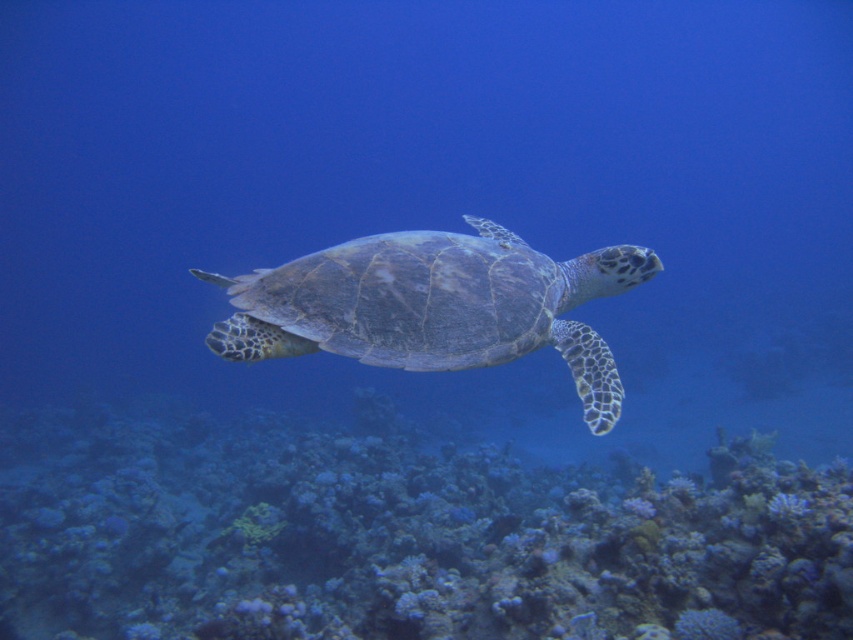
Who is shorter, rusty coral reef at center or greenish-gray textured shell at center?

greenish-gray textured shell at center

Is the position of rusty coral reef at center less distant than that of greenish-gray textured shell at center?

Yes, it is in front of greenish-gray textured shell at center.

Which is behind, point (44, 468) or point (605, 259)?

The point (44, 468) is more distant.

At what (x,y) coordinates should I click in order to perform the action: click on rusty coral reef at center. Please return your answer as a coordinate pair (x, y). Looking at the image, I should click on (399, 536).